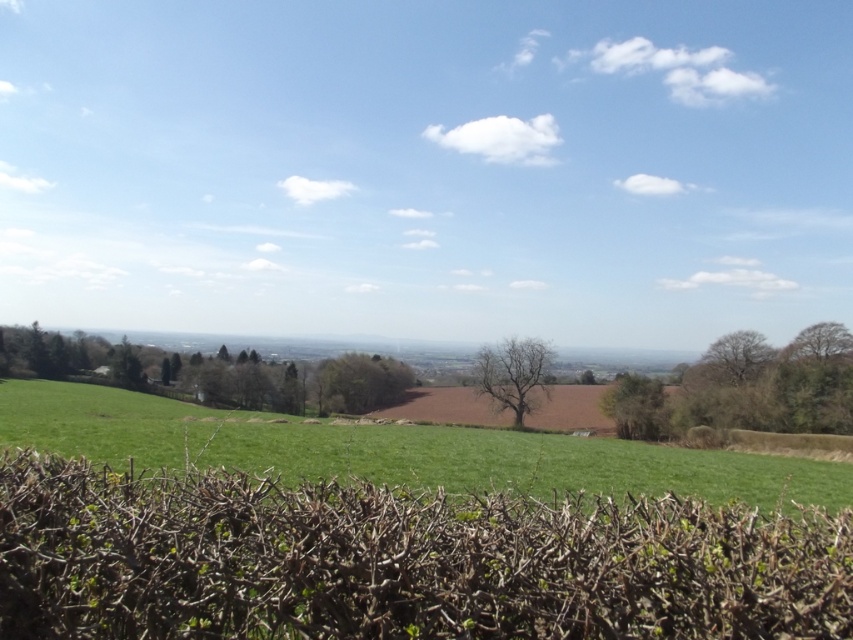
Is green leafy tree at center-right to the right of brown textured tree at right from the viewer's perspective?

No, green leafy tree at center-right is not to the right of brown textured tree at right.

Who is more distant from viewer, (605, 413) or (714, 346)?

The point (714, 346) is behind.

You are a GUI agent. You are given a task and a screenshot of the screen. Output one action in this format:
    pyautogui.click(x=<x>, y=<y>)
    Task: Click on the green leafy tree at center-right
    Image resolution: width=853 pixels, height=640 pixels.
    Given the screenshot: What is the action you would take?
    pyautogui.click(x=636, y=406)

Identify the location of green leafy tree at center-right. This screenshot has height=640, width=853. (636, 406).

Between point (607, 403) and point (822, 355), which one is positioned behind?

Point (822, 355)

Based on the photo, can you confirm if green leafy tree at center-right is positioned to the left of bare branches at upper right?

Yes, green leafy tree at center-right is to the left of bare branches at upper right.

Locate an element on the screen. green leafy tree at center-right is located at coordinates (636, 406).

Describe the element at coordinates (360, 381) in the screenshot. The height and width of the screenshot is (640, 853). I see `green leafy tree at center` at that location.

Does green leafy tree at center have a greater width compared to brown textured tree at right?

Indeed, green leafy tree at center has a greater width compared to brown textured tree at right.

Between point (332, 381) and point (747, 339), which one is positioned in front?

Point (747, 339)

The width and height of the screenshot is (853, 640). Find the location of `green leafy tree at center`. green leafy tree at center is located at coordinates (360, 381).